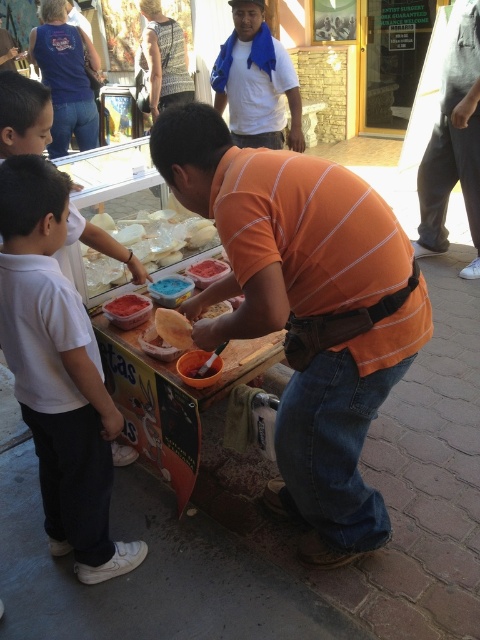
Question: Does blue fabric scarf at upper center have a smaller size compared to matte brown bread at center?

Choices:
 (A) yes
 (B) no

Answer: (B)

Question: Does blue fabric scarf at upper center appear on the left side of smooth pink ice cream at center?

Choices:
 (A) yes
 (B) no

Answer: (B)

Question: Is white matte shirt at left positioned at the back of jeans at center?

Choices:
 (A) no
 (B) yes

Answer: (A)

Question: Which of these objects is positioned farthest from the white creamy cheese at center?

Choices:
 (A) blue fabric scarf at upper center
 (B) smooth pink ice cream at center
 (C) jeans at center
 (D) smooth pink paste at center

Answer: (C)

Question: Considering the real-world distances, which object is farthest from the orange striped shirt at center?

Choices:
 (A) white creamy cheese at center
 (B) matte brown bread at center
 (C) white matte shirt at left
 (D) white shirt at left

Answer: (A)

Question: Which of the following is the farthest from the observer?

Choices:
 (A) blue fabric scarf at upper center
 (B) white shirt at left
 (C) orange striped shirt at center

Answer: (A)